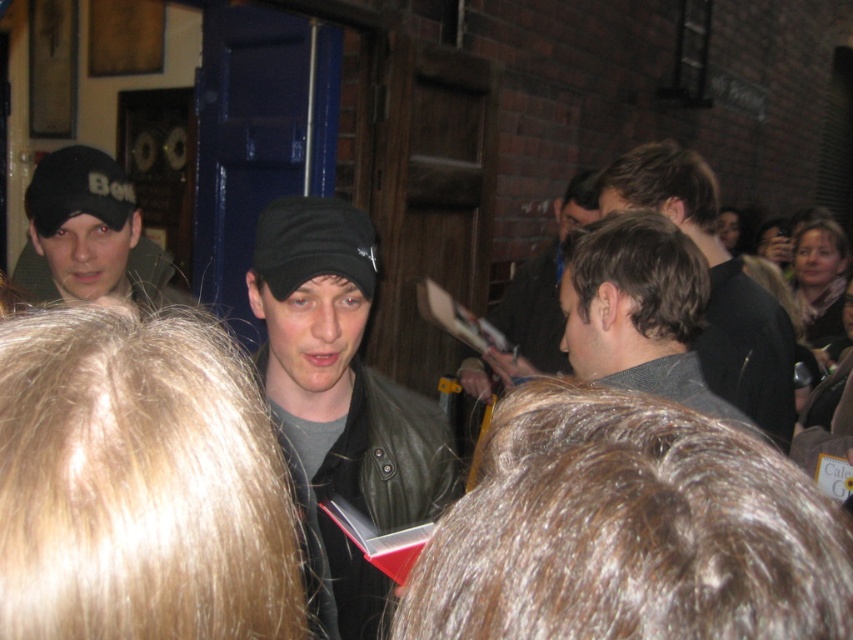
From the picture: Between black leather jacket at center and black matte cap at left, which one is positioned higher?

Positioned higher is black matte cap at left.

The image size is (853, 640). What do you see at coordinates (339, 404) in the screenshot?
I see `black leather jacket at center` at bounding box center [339, 404].

At what (x,y) coordinates should I click in order to perform the action: click on black leather jacket at center. Please return your answer as a coordinate pair (x, y). Image resolution: width=853 pixels, height=640 pixels. Looking at the image, I should click on (339, 404).

The height and width of the screenshot is (640, 853). Describe the element at coordinates (90, 236) in the screenshot. I see `black matte cap at left` at that location.

Does point (88, 209) lie in front of point (534, 346)?

Yes, point (88, 209) is closer to viewer.

Does point (71, 157) lie in front of point (541, 349)?

Yes, it is in front of point (541, 349).

This screenshot has width=853, height=640. What are the coordinates of `black matte cap at left` in the screenshot? It's located at (90, 236).

Can you confirm if black leather jacket at center is positioned above leather jacket at center?

No, black leather jacket at center is not above leather jacket at center.

What do you see at coordinates (339, 404) in the screenshot? I see `black leather jacket at center` at bounding box center [339, 404].

Identify the location of black leather jacket at center. (339, 404).